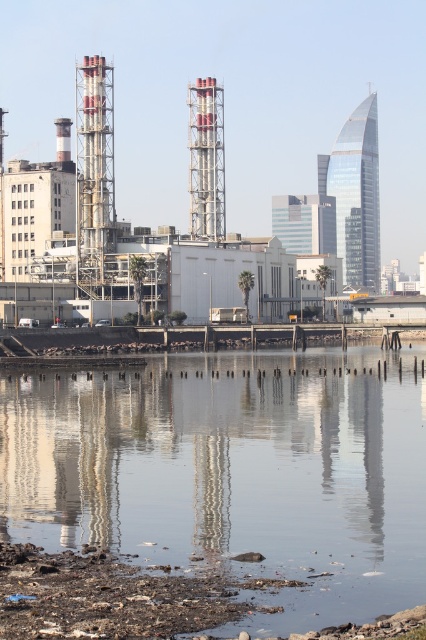
Question: Can you confirm if transparent water at center is wider than matte gray industrial structure at center?

Choices:
 (A) no
 (B) yes

Answer: (A)

Question: Can you confirm if transparent water at center is bigger than matte gray industrial structure at center?

Choices:
 (A) yes
 (B) no

Answer: (B)

Question: Does transparent water at center come behind matte gray industrial structure at center?

Choices:
 (A) yes
 (B) no

Answer: (B)